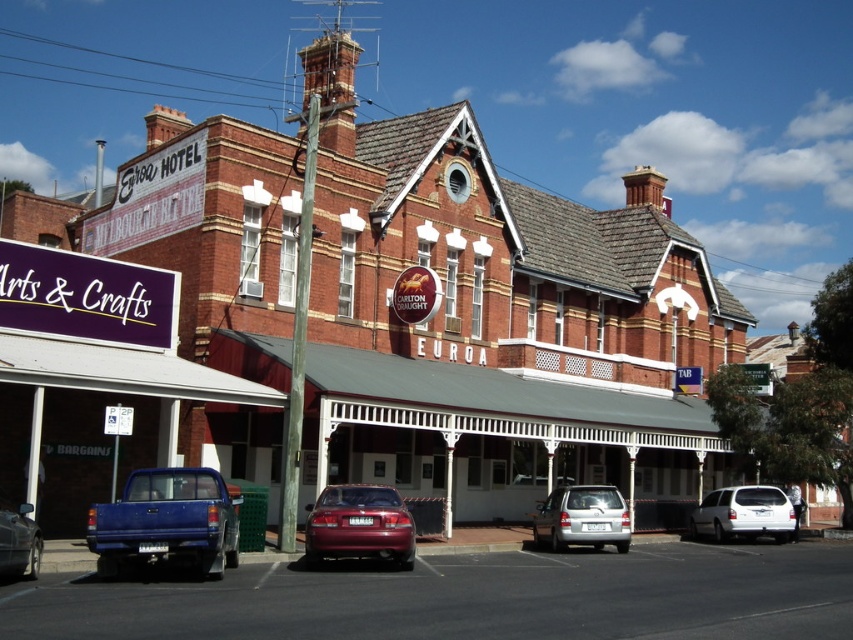
Who is more distant from viewer, (x=415, y=403) or (x=590, y=531)?

The point (x=415, y=403) is more distant.

Can you confirm if white painted wood awning at center is bigger than silver metallic hatchback at center?

Correct, white painted wood awning at center is larger in size than silver metallic hatchback at center.

Image resolution: width=853 pixels, height=640 pixels. Identify the location of white painted wood awning at center. (502, 436).

Is shiny red sedan at center above silver metallic hatchback at center?

Yes.

Where is `shiny red sedan at center`? shiny red sedan at center is located at coordinates (358, 525).

Can you confirm if white painted wood awning at center is positioned to the left of shiny red sedan at center?

In fact, white painted wood awning at center is to the right of shiny red sedan at center.

Is white painted wood awning at center below shiny red sedan at center?

Indeed, white painted wood awning at center is positioned under shiny red sedan at center.

In order to click on white painted wood awning at center in this screenshot , I will do `click(502, 436)`.